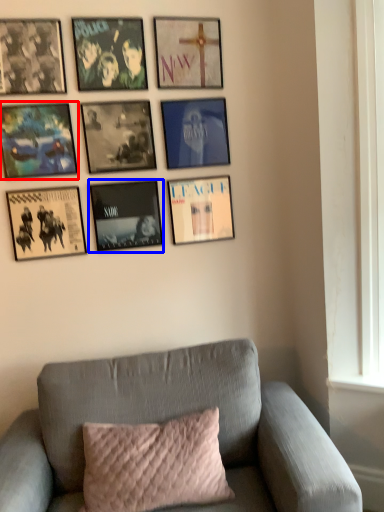
Question: Which of the following is the closest to the observer, picture frame (highlighted by a red box) or picture frame (highlighted by a blue box)?

Choices:
 (A) picture frame
 (B) picture frame

Answer: (A)